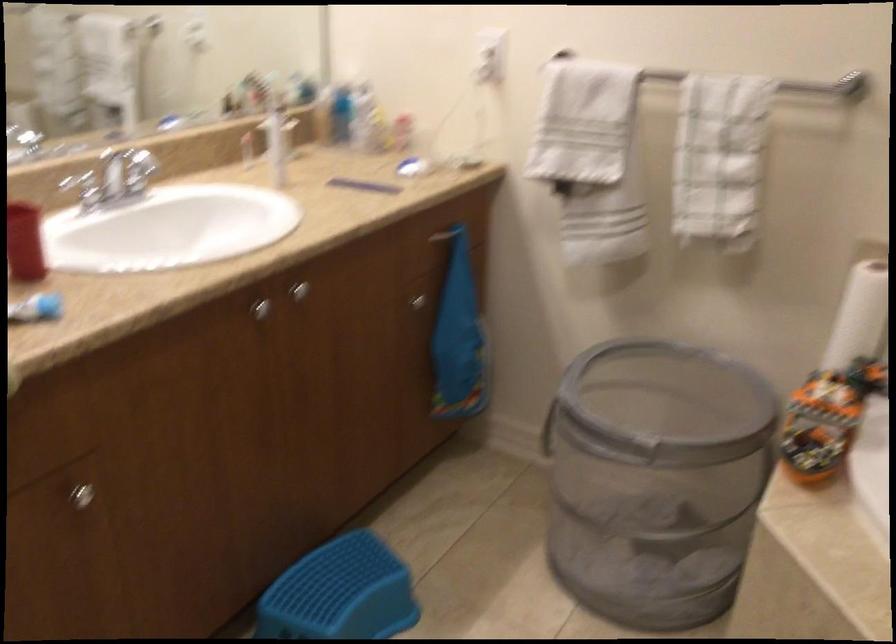
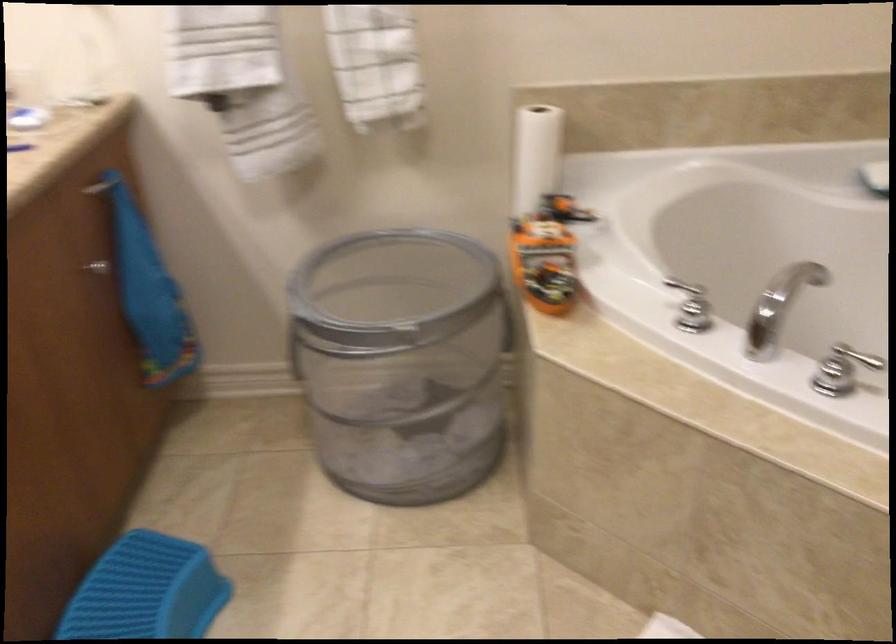
In the second image, find the point that corresponds to (417,299) in the first image.

(97, 267)